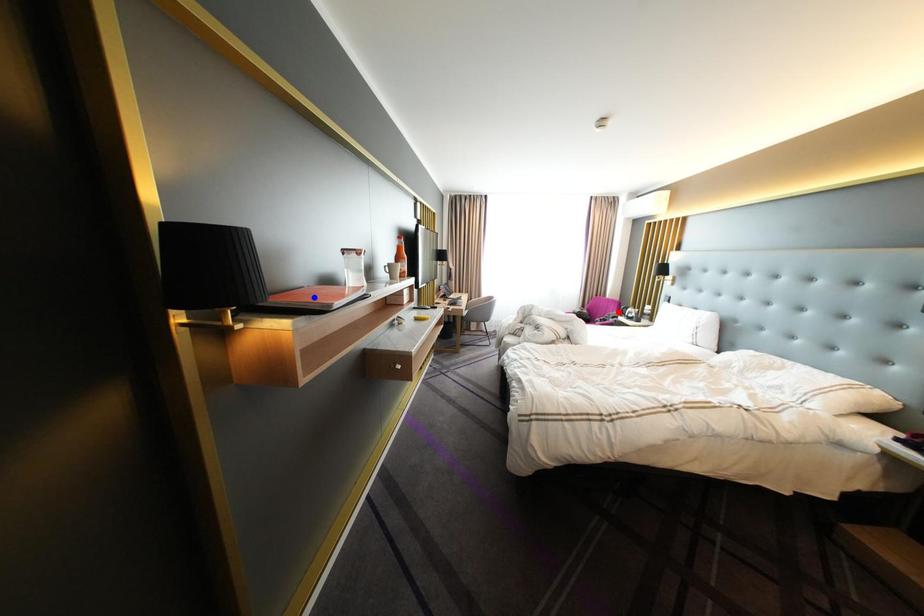
Question: In the image, two points are highlighted. Which point is nearer to the camera? Reply with the corresponding letter.

Choices:
 (A) blue point
 (B) red point

Answer: (A)